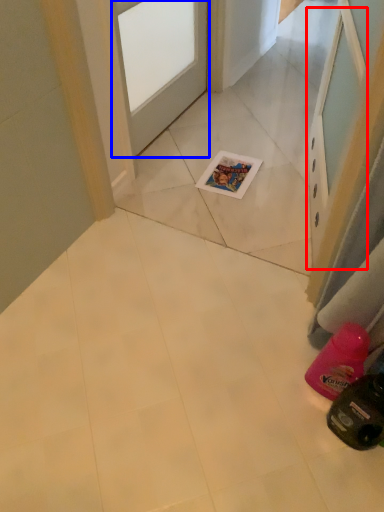
Question: Which point is closer to the camera, screen door (highlighted by a red box) or door (highlighted by a blue box)?

Choices:
 (A) screen door
 (B) door

Answer: (A)